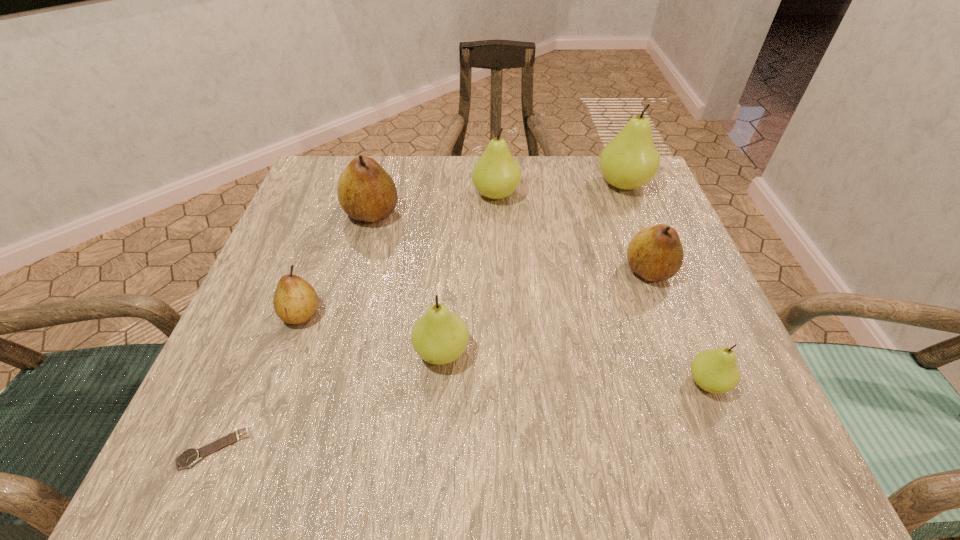
What are the coordinates of `the tallest object` in the screenshot? It's located at (x=630, y=160).

Image resolution: width=960 pixels, height=540 pixels. Identify the location of the tallest pear. click(x=630, y=160).

Find the location of a particular element. This screenshot has width=960, height=540. the third smallest green pear is located at coordinates (496, 175).

Where is `the biggest brown pear`? This screenshot has height=540, width=960. the biggest brown pear is located at coordinates (366, 192).

Find the location of a particular element. the fifth nearest object is located at coordinates (655, 253).

Identify the location of the fourth nearest pear. (655, 253).

What are the coordinates of `the second smallest green pear` in the screenshot? It's located at (439, 337).

Find the location of a particular element. The width and height of the screenshot is (960, 540). the smallest brown pear is located at coordinates [x=295, y=301].

The width and height of the screenshot is (960, 540). In order to click on the smallest green pear in this screenshot , I will do click(x=714, y=370).

This screenshot has width=960, height=540. Identify the location of the shortest object. (189, 457).